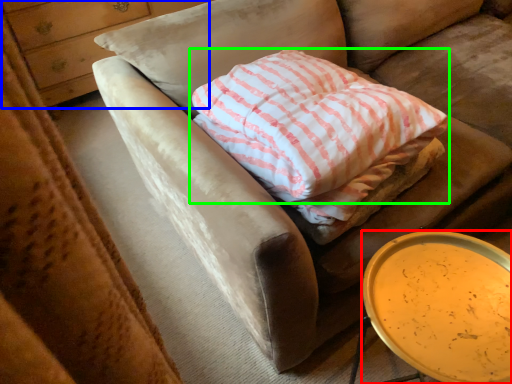
Question: Considering the real-world distances, which object is closest to table (highlighted by a red box)? dresser (highlighted by a blue box) or pillow (highlighted by a green box).

Choices:
 (A) dresser
 (B) pillow

Answer: (B)